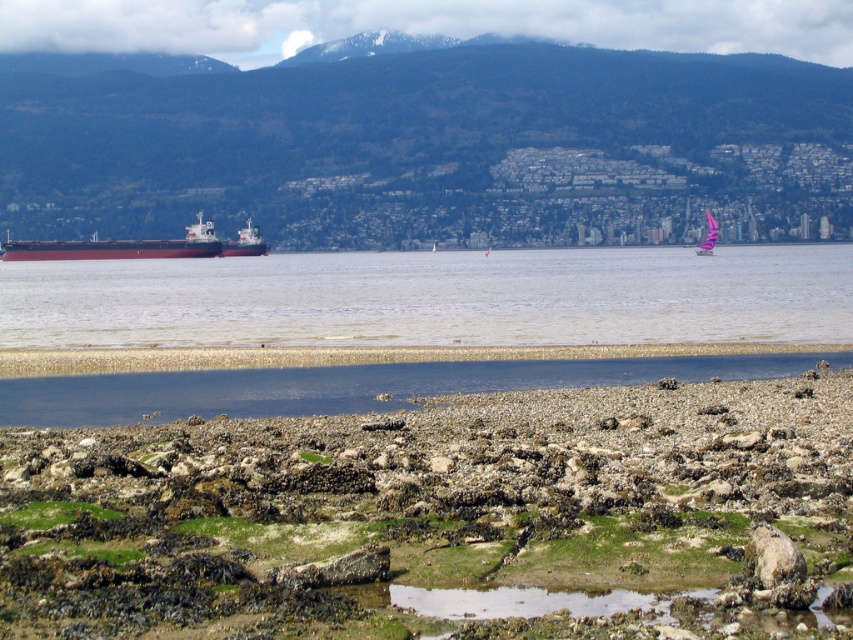
Is smooth water at center positioned before red matte cargo ship at left?

That is True.

The width and height of the screenshot is (853, 640). Describe the element at coordinates (434, 298) in the screenshot. I see `smooth water at center` at that location.

In order to click on smooth water at center in this screenshot , I will do `click(434, 298)`.

Who is more forward, (107, 113) or (341, 260)?

Point (341, 260) is in front.

Is green forested mountain at upper center above smooth water at center?

Yes.

Does point (207, 68) lie in front of point (469, 280)?

No, (207, 68) is behind (469, 280).

Find the location of `green forested mountain at upper center`. green forested mountain at upper center is located at coordinates (419, 141).

Is green forested mountain at upper center bigger than pink fabric sailboat at center?

Indeed, green forested mountain at upper center has a larger size compared to pink fabric sailboat at center.

In the scene shown: Can you confirm if green forested mountain at upper center is positioned below pink fabric sailboat at center?

No.

At what (x,y) coordinates should I click in order to perform the action: click on green forested mountain at upper center. Please return your answer as a coordinate pair (x, y). The image size is (853, 640). Looking at the image, I should click on (419, 141).

You are a GUI agent. You are given a task and a screenshot of the screen. Output one action in this format:
    pyautogui.click(x=<x>, y=<y>)
    Task: Click on the green forested mountain at upper center
    The width and height of the screenshot is (853, 640).
    Given the screenshot: What is the action you would take?
    pyautogui.click(x=419, y=141)